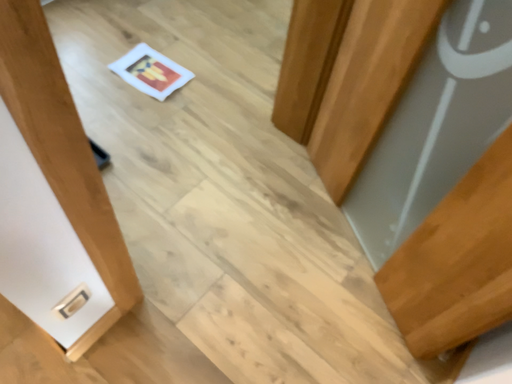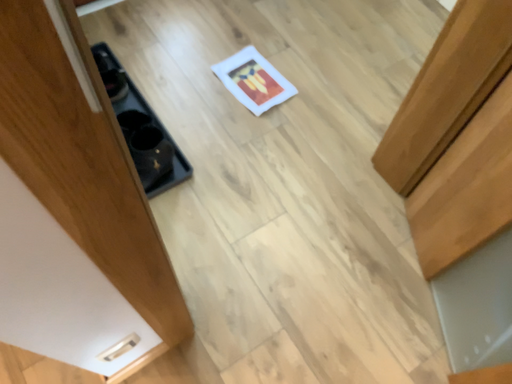
Question: Which way did the camera rotate in the video?

Choices:
 (A) rotated left
 (B) rotated right

Answer: (A)